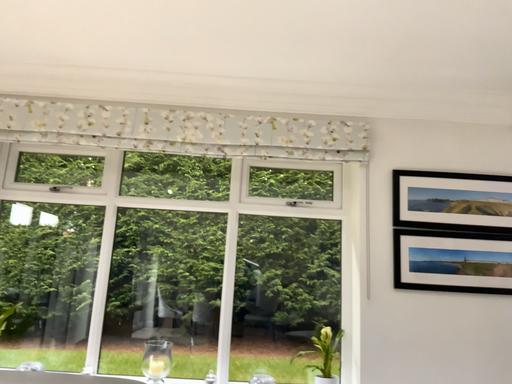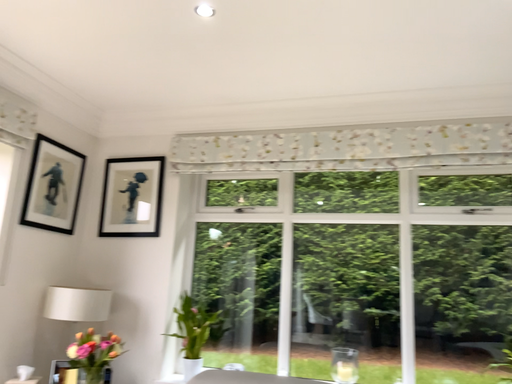
Question: Which way did the camera rotate in the video?

Choices:
 (A) rotated left
 (B) rotated right

Answer: (A)